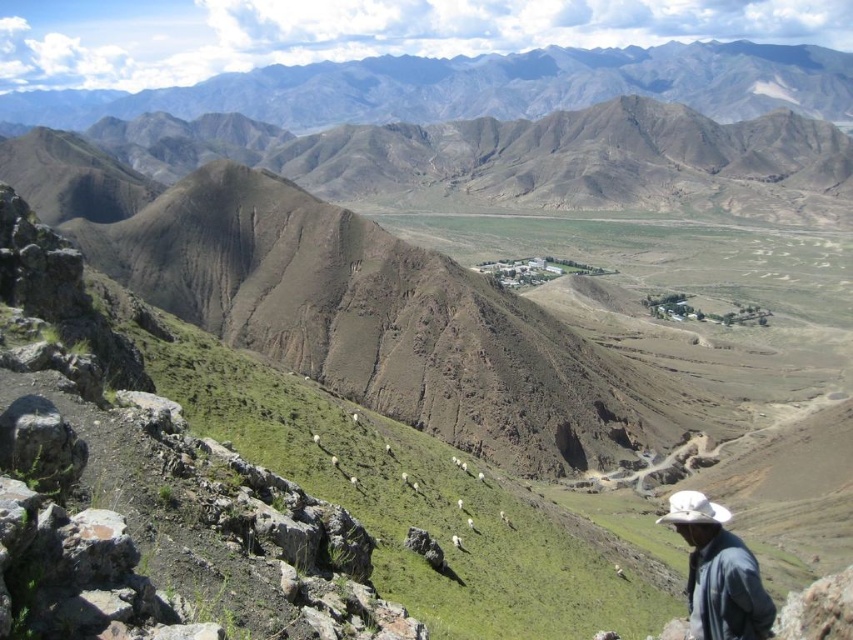
Can you confirm if gray rocky mountains at upper center is positioned to the right of dark blue denim jacket at lower right?

In fact, gray rocky mountains at upper center is to the left of dark blue denim jacket at lower right.

Between point (334, 65) and point (747, 604), which one is positioned behind?

The point (334, 65) is behind.

At what (x,y) coordinates should I click in order to perform the action: click on gray rocky mountains at upper center. Please return your answer as a coordinate pair (x, y). This screenshot has height=640, width=853. Looking at the image, I should click on (480, 86).

Where is `gray rocky mountains at upper center`? Image resolution: width=853 pixels, height=640 pixels. gray rocky mountains at upper center is located at coordinates (480, 86).